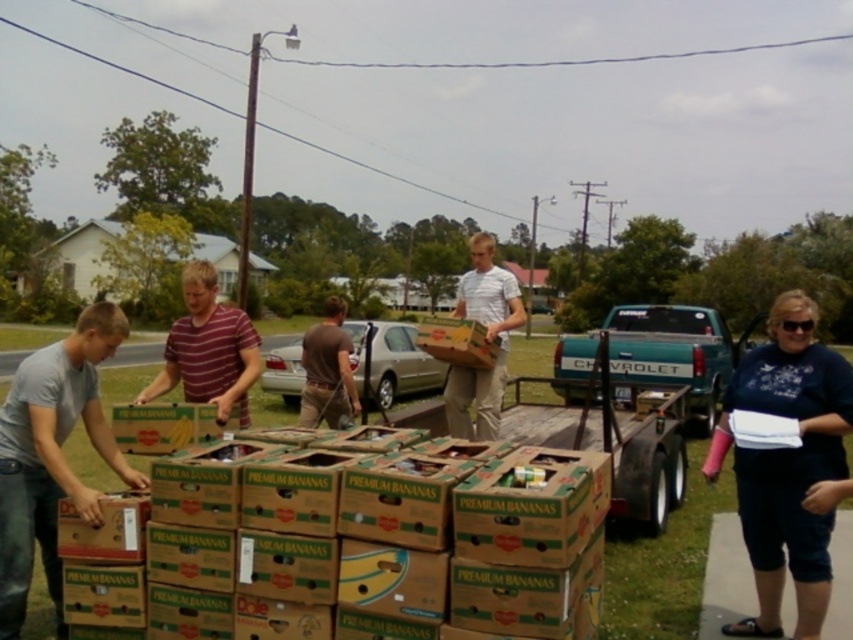
Question: Among these objects, which one is farthest from the camera?

Choices:
 (A) white cotton shirt at lower right
 (B) teal metallic truck at center
 (C) brown cotton shirt at center
 (D) striped shirt at center

Answer: (B)

Question: Which object is the closest to the brown cardboard box at center?

Choices:
 (A) white cotton shirt at lower right
 (B) white matte shirt at center

Answer: (B)

Question: Is gray matte shirt at left above green cardboard box at lower left?

Choices:
 (A) yes
 (B) no

Answer: (B)

Question: Is white cotton shirt at lower right positioned at the back of white matte shirt at center?

Choices:
 (A) yes
 (B) no

Answer: (B)

Question: Does teal metallic truck at center have a greater width compared to white matte shirt at center?

Choices:
 (A) yes
 (B) no

Answer: (A)

Question: Which object is closer to the camera taking this photo?

Choices:
 (A) white matte shirt at center
 (B) striped shirt at center
 (C) brown cotton shirt at center

Answer: (B)